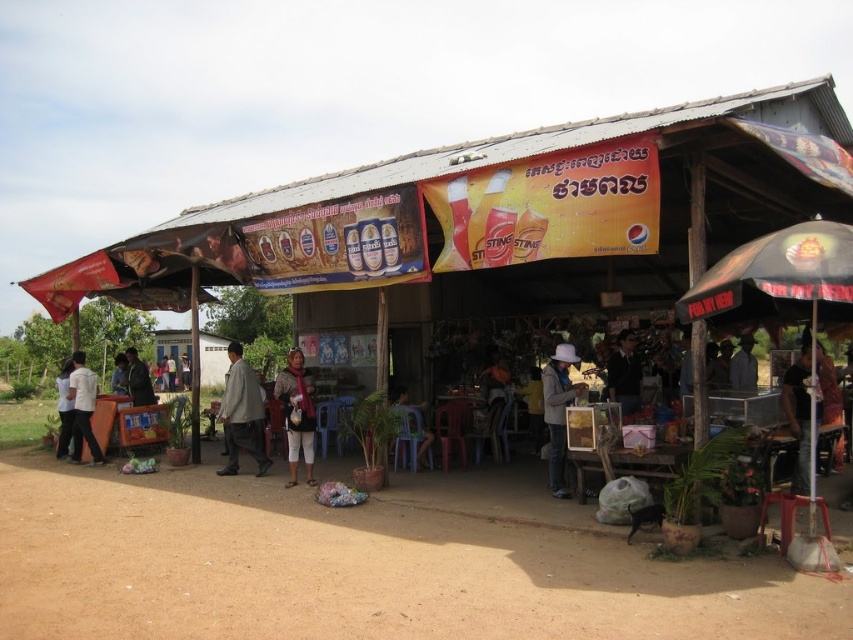
You are a customer at the rustic outdoor food stall and want to sit down. You see the brown dirt field at lower center and the matte pink scarf at center. Which object is closer to the ground?

The brown dirt field at lower center is located below matte pink scarf at center, so it is closer to the ground.

You are a customer at the rustic outdoor food stall. You notice a black fabric umbrella at right and a white matte shirt at left. Which object is located to the right of the other?

The black fabric umbrella at right is positioned on the right side of white matte shirt at left.